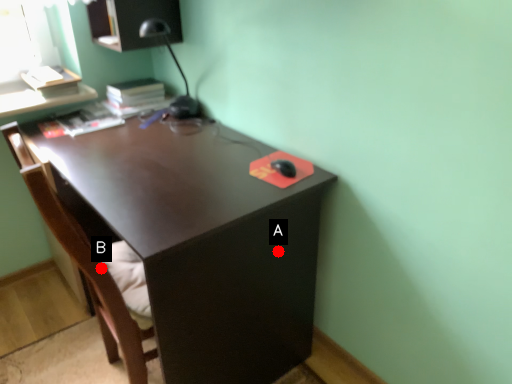
Question: Two points are circled on the image, labeled by A and B beside each circle. Among these points, which one is nearest to the camera?

Choices:
 (A) A is closer
 (B) B is closer

Answer: (B)